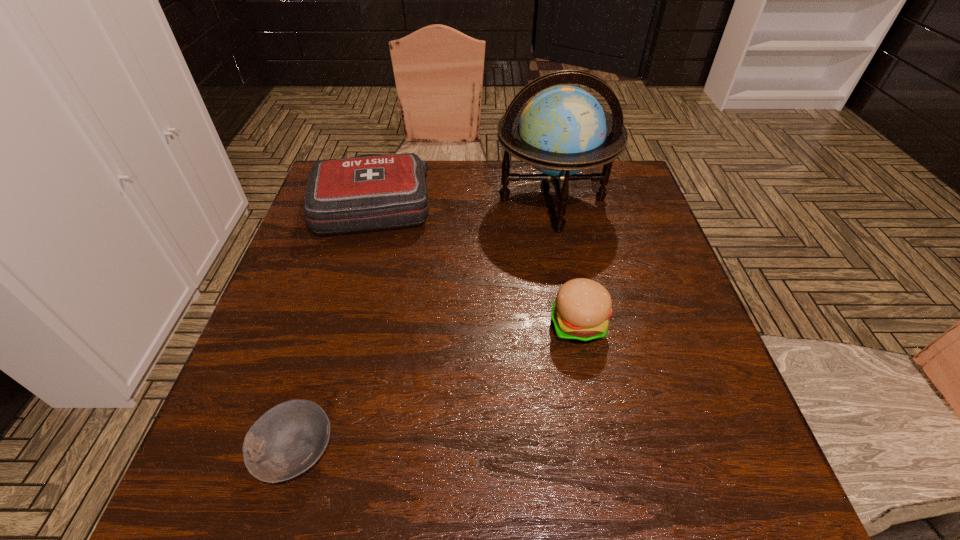
Image resolution: width=960 pixels, height=540 pixels. I want to click on globe, so click(563, 130).

Locate an element on the screen. the first-aid kit is located at coordinates 373,191.

Where is `hamburger`? This screenshot has height=540, width=960. hamburger is located at coordinates (580, 313).

At what (x,y) coordinates should I click in order to perform the action: click on the nearest object. Please return your answer as a coordinate pair (x, y). Looking at the image, I should click on (288, 439).

You are a GUI agent. You are given a task and a screenshot of the screen. Output one action in this format:
    pyautogui.click(x=<x>, y=<y>)
    Task: Click on the shortest object
    This screenshot has width=960, height=540.
    Given the screenshot: What is the action you would take?
    pyautogui.click(x=288, y=439)

Identify the location of vacant area situated on the surface of the tallest object. The height and width of the screenshot is (540, 960). (578, 335).

You are a GUI agent. You are given a task and a screenshot of the screen. Output one action in this format:
    pyautogui.click(x=<x>, y=<y>)
    Task: Click on the vacant area situated on the right of the first-aid kit
    
    Given the screenshot: What is the action you would take?
    pyautogui.click(x=476, y=203)

Find the location of a particular element. The height and width of the screenshot is (540, 960). vacant area located 0.190m on the front of the third farthest object is located at coordinates (600, 438).

Find the location of `free space located on the right of the shortest object`. free space located on the right of the shortest object is located at coordinates (561, 451).

Locate an element on the screen. Image resolution: width=960 pixels, height=540 pixels. globe that is at the far edge is located at coordinates (563, 130).